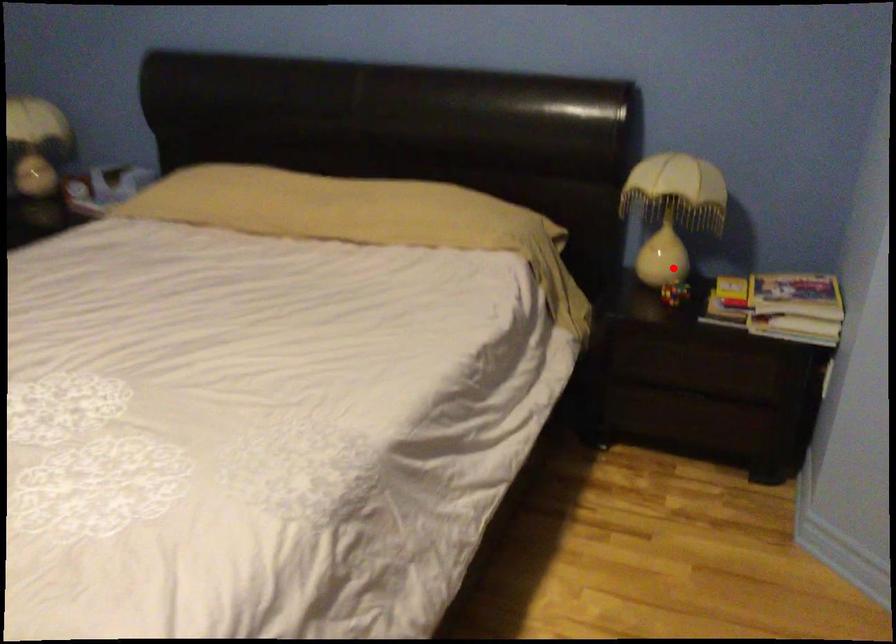
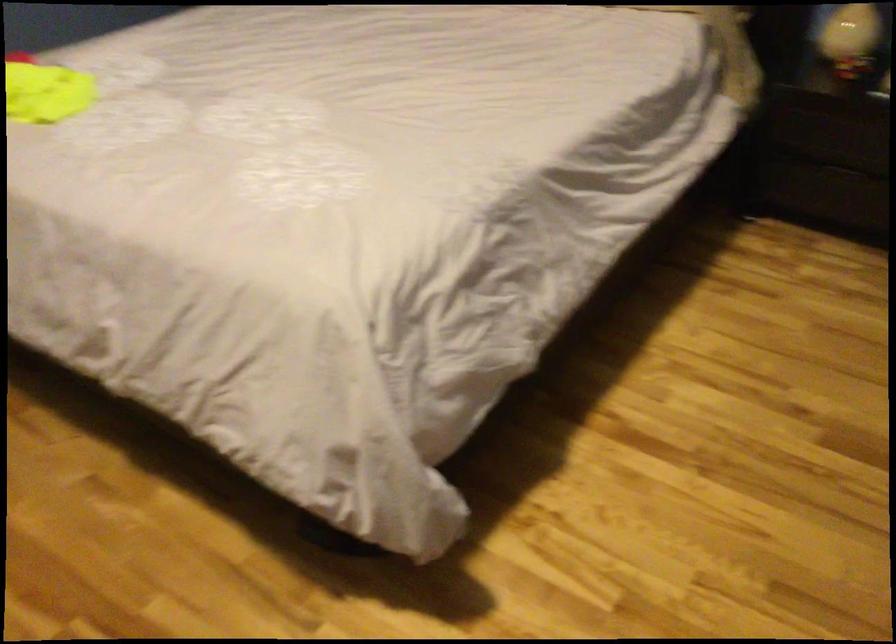
Locate, in the second image, the point that corresponds to the highlighted location in the first image.

(851, 39)